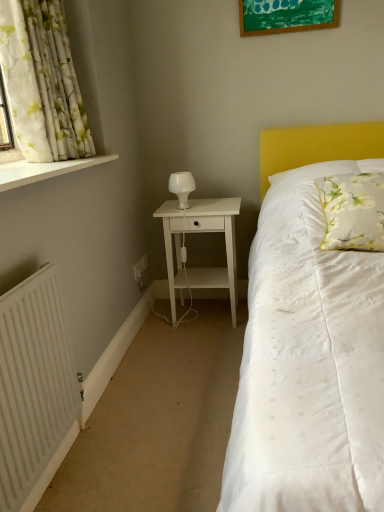
Where is `free location to the right of white ribbed radiator at lower left`? free location to the right of white ribbed radiator at lower left is located at coordinates (138, 463).